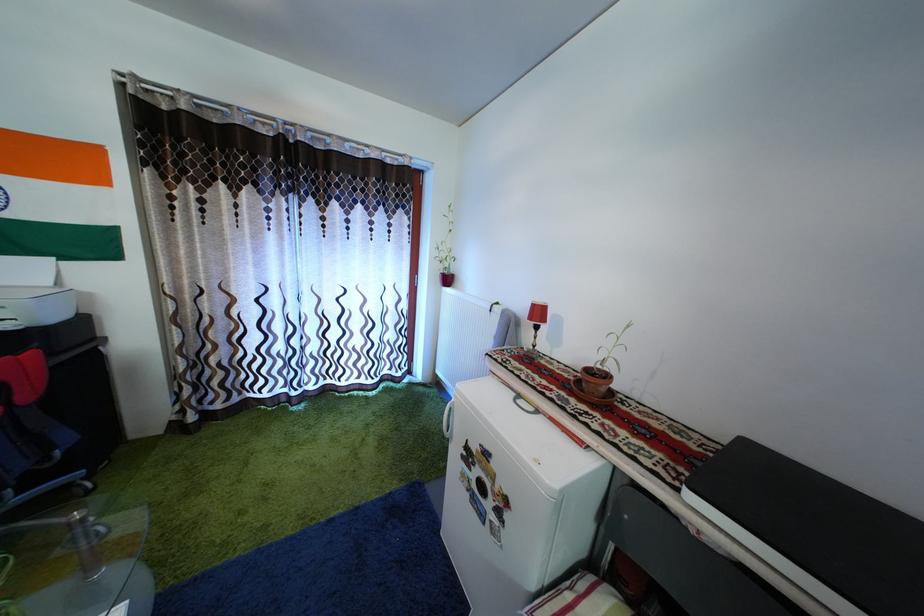
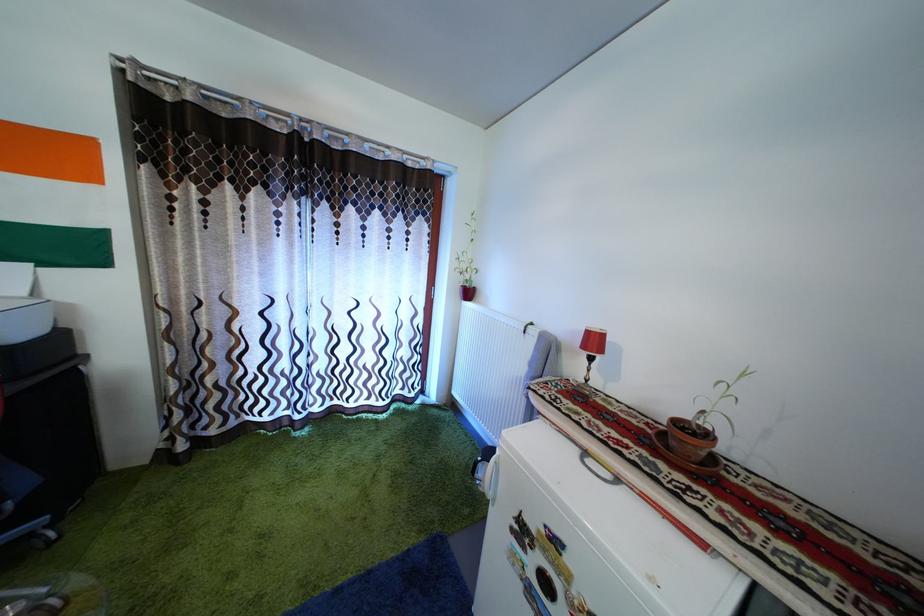
Find the pixel in the second image that matches point 541,313 in the first image.

(598, 339)